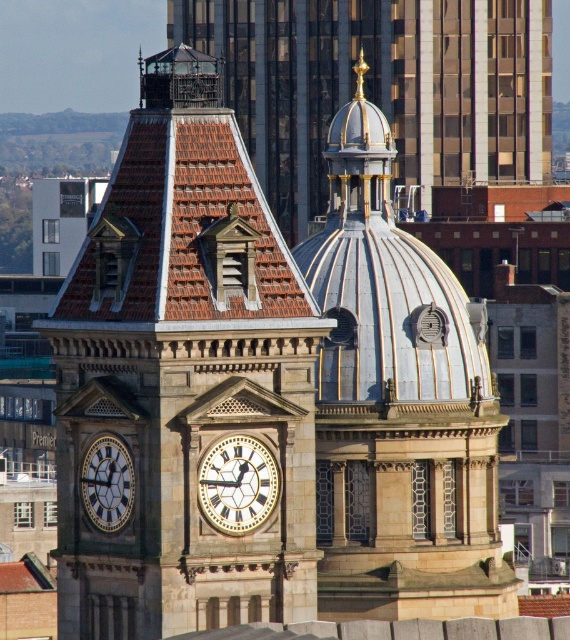
Question: Which point is closer to the camera?

Choices:
 (A) gold-toned metal clock at left
 (B) white marble clock at center
 (C) brown stone clock tower at center
 (D) polished silver dome at center

Answer: (C)

Question: Which of the following is the closest to the observer?

Choices:
 (A) (206, 464)
 (B) (263, 364)
 (C) (95, 515)
 (D) (321, 416)

Answer: (A)

Question: Which point appears closest to the camera in this image?

Choices:
 (A) (475, 513)
 (B) (274, 426)

Answer: (B)

Question: Can you confirm if polished silver dome at center is positioned below white marble clock at center?

Choices:
 (A) yes
 (B) no

Answer: (B)

Question: Is brown stone clock tower at center in front of polished silver dome at center?

Choices:
 (A) yes
 (B) no

Answer: (A)

Question: Can you confirm if brown stone clock tower at center is positioned below white marble clock at center?

Choices:
 (A) yes
 (B) no

Answer: (B)